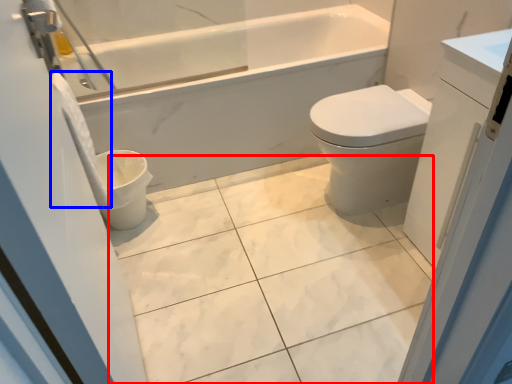
Question: Among these objects, which one is farthest to the camera, ceramic tile (highlighted by a red box) or toilet paper (highlighted by a blue box)?

Choices:
 (A) ceramic tile
 (B) toilet paper

Answer: (B)